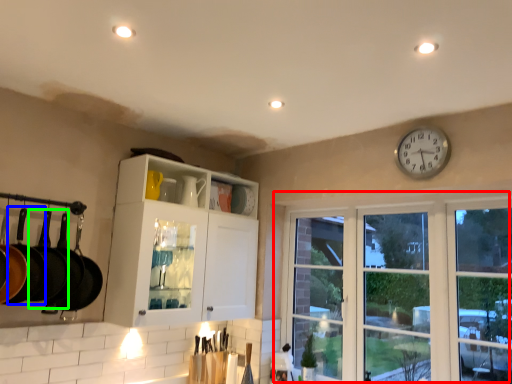
Question: Which object is the closest to the window (highlighted by a red box)? Choose among these: frying pan (highlighted by a blue box) or frying pan (highlighted by a green box).

Choices:
 (A) frying pan
 (B) frying pan

Answer: (B)